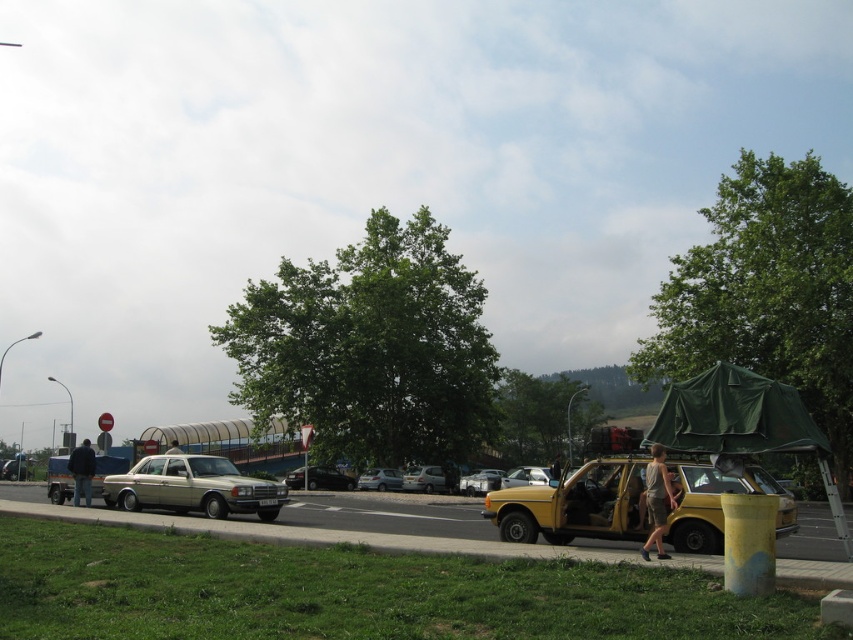
In the scene shown: You are a gardener who needs to mow the lawn. You see the green grass at lower left and the gold metallic sedan at center. Which area should you mow first if the grass is too tall compared to the car?

The green grass at lower left should be mowed first because it is taller than the gold metallic sedan at center, indicating it needs attention.